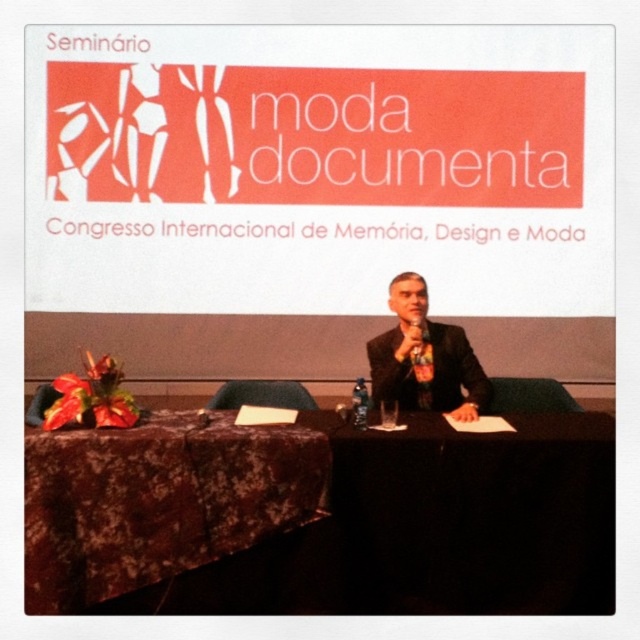
Is velvet dark brown tablecloth at lower left below black suit at center?

Correct, velvet dark brown tablecloth at lower left is located below black suit at center.

Can you confirm if velvet dark brown tablecloth at lower left is smaller than black suit at center?

Actually, velvet dark brown tablecloth at lower left might be larger than black suit at center.

Locate an element on the screen. The width and height of the screenshot is (640, 640). velvet dark brown tablecloth at lower left is located at coordinates (157, 500).

The width and height of the screenshot is (640, 640). I want to click on velvet dark brown tablecloth at lower left, so click(157, 500).

Is point (577, 483) positioned before point (388, 358)?

Yes.

Is point (492, 468) farther from viewer compared to point (384, 385)?

That is False.

The height and width of the screenshot is (640, 640). Identify the location of black fabric table at center. (476, 515).

Does black fabric table at center appear over velvet dark brown tablecloth at lower left?

Actually, black fabric table at center is below velvet dark brown tablecloth at lower left.

Does black fabric table at center have a greater height compared to velvet dark brown tablecloth at lower left?

Correct, black fabric table at center is much taller as velvet dark brown tablecloth at lower left.

Who is more distant from viewer, (561, 604) or (170, 417)?

The point (170, 417) is behind.

You are a GUI agent. You are given a task and a screenshot of the screen. Output one action in this format:
    pyautogui.click(x=<x>, y=<y>)
    Task: Click on the black fabric table at center
    The image size is (640, 640).
    Given the screenshot: What is the action you would take?
    pyautogui.click(x=476, y=515)